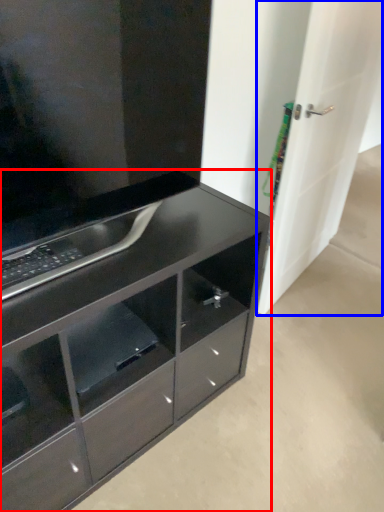
Question: Which point is further to the camera, chest of drawers (highlighted by a red box) or door (highlighted by a blue box)?

Choices:
 (A) chest of drawers
 (B) door

Answer: (B)